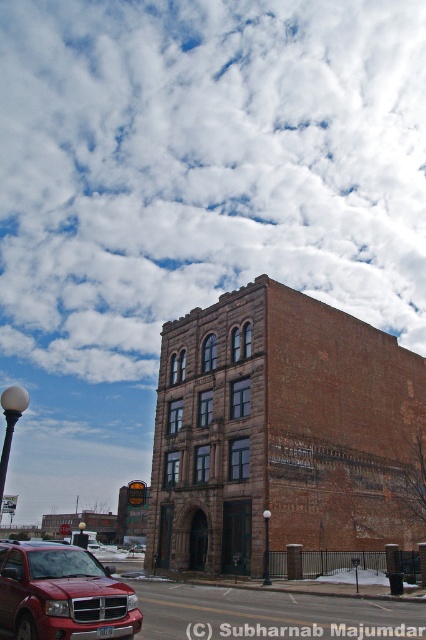
Which is below, white fluffy cloud at upper center or matte red suv at lower left?

matte red suv at lower left is lower down.

This screenshot has height=640, width=426. Describe the element at coordinates (204, 166) in the screenshot. I see `white fluffy cloud at upper center` at that location.

Identify the location of white fluffy cloud at upper center. (204, 166).

Can you confirm if matte red suv at lower left is positioned to the left of metallic red suv at lower left?

→ Incorrect, matte red suv at lower left is not on the left side of metallic red suv at lower left.

Looking at this image, which is above, matte red suv at lower left or metallic red suv at lower left?

matte red suv at lower left is above.

The width and height of the screenshot is (426, 640). Find the location of `matte red suv at lower left`. matte red suv at lower left is located at coordinates (63, 595).

At what (x,y) coordinates should I click in order to perform the action: click on matte red suv at lower left. Please return your answer as a coordinate pair (x, y). Image resolution: width=426 pixels, height=640 pixels. Looking at the image, I should click on (63, 595).

Between point (218, 84) and point (129, 547), which one is positioned in front?

Positioned in front is point (129, 547).

Between white fluffy cloud at upper center and metallic red suv at lower left, which one has less height?

With less height is metallic red suv at lower left.

Which is in front, point (80, 173) or point (138, 552)?

Point (138, 552) is more forward.

I want to click on white fluffy cloud at upper center, so pos(204,166).